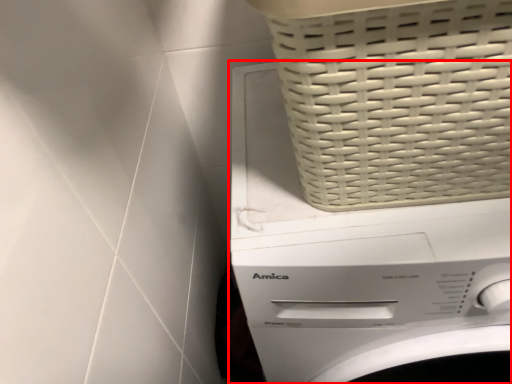
Question: From the image's perspective, what is the correct spatial positioning of washing machine (annotated by the red box) in reference to basket?

Choices:
 (A) above
 (B) below

Answer: (B)